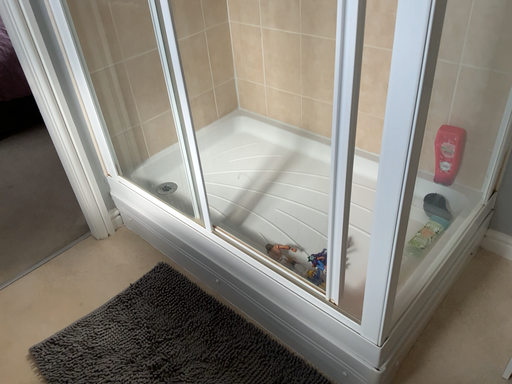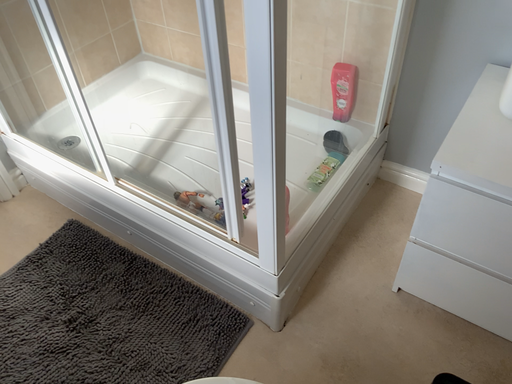
Question: Which way did the camera rotate in the video?

Choices:
 (A) rotated upward
 (B) rotated downward

Answer: (B)